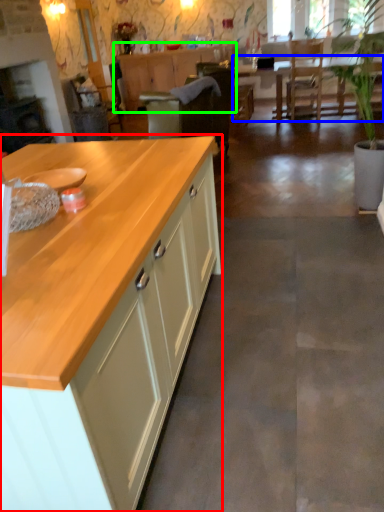
Question: Which object is positioned farthest from cabinetry (highlighted by a red box)? Select from table (highlighted by a blue box) and cabinetry (highlighted by a green box).

Choices:
 (A) table
 (B) cabinetry

Answer: (B)